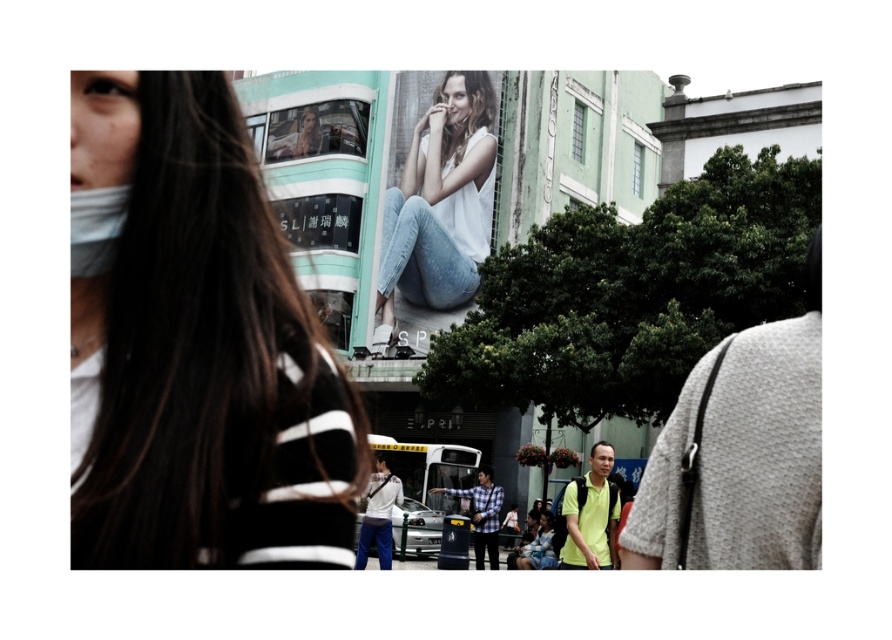
You are a fashion designer observing the urban street scene. You notice the white matte face mask at left and the white matte tank top at center. Which item is larger in size?

The white matte tank top at center is larger in size compared to the white matte face mask at left.

You are standing on the bustling urban street and see two points marked on the image. Which point is closer to you, point (x=415, y=128) or point (x=103, y=193)?

Point (x=415, y=128) is further to the viewer than point (x=103, y=193), so point (x=103, y=193) is closer to you.